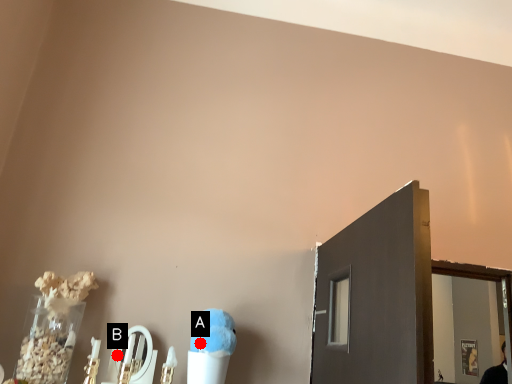
Question: Two points are circled on the image, labeled by A and B beside each circle. Which point is closer to the camera taking this photo?

Choices:
 (A) A is closer
 (B) B is closer

Answer: (A)